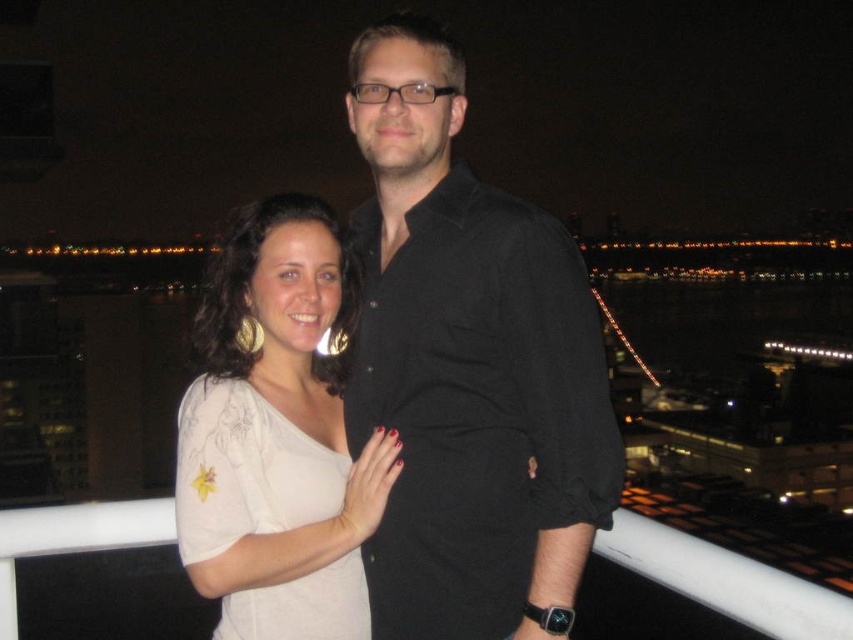
You are a fashion designer observing two people in the scene. You notice a black cotton shirt at center and a white matte blouse at center. Which clothing item is positioned to the right?

The black cotton shirt at center is to the right of the white matte blouse at center.

You are a photographer trying to capture the man in the black cotton shirt at center. The camera you are using has a focus point at coordinate point (469, 368). Will this focus point align with the man in the black cotton shirt at center?

Yes, the black cotton shirt at center is represented by point (469, 368), so the focus point will align with the man in the black cotton shirt at center.